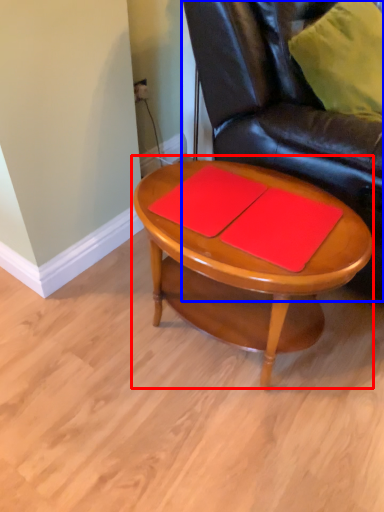
Question: Among these objects, which one is nearest to the camera, coffee table (highlighted by a red box) or chair (highlighted by a blue box)?

Choices:
 (A) coffee table
 (B) chair

Answer: (B)